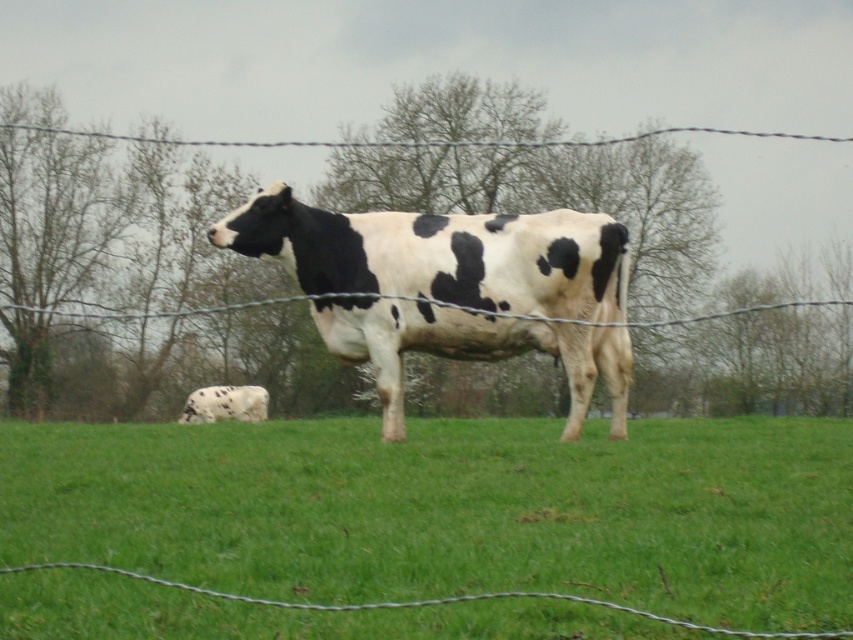
Question: Is green grass at center wider than wire at center?

Choices:
 (A) no
 (B) yes

Answer: (A)

Question: Among these objects, which one is farthest from the camera?

Choices:
 (A) white spotted cow at lower left
 (B) black and white spotted cow at center
 (C) wire at center

Answer: (A)

Question: Can you confirm if green grass at center is positioned above wire at center?

Choices:
 (A) no
 (B) yes

Answer: (A)

Question: Is the position of black and white spotted cow at center more distant than that of wire at center?

Choices:
 (A) no
 (B) yes

Answer: (B)

Question: Estimate the real-world distances between objects in this image. Which object is closer to the black and white spotted cow at center?

Choices:
 (A) wire at center
 (B) green grass at center

Answer: (B)

Question: Among these points, which one is nearest to the camera?

Choices:
 (A) (186, 412)
 (B) (715, 529)

Answer: (B)